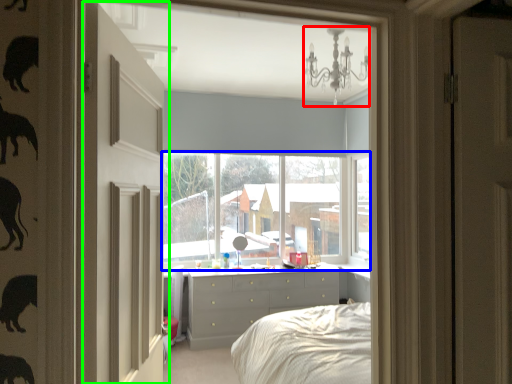
Question: Which is nearer to the light fixture (highlighted by a red box)? window (highlighted by a blue box) or door (highlighted by a green box).

Choices:
 (A) window
 (B) door

Answer: (B)